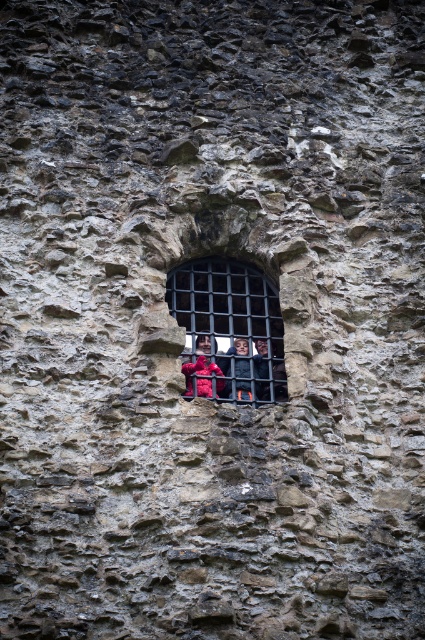
You are standing in front of an ancient stone wall with an arched window. A point on the wall is marked at coordinates point (251,333). If you want to touch this point with a 200 feet long stick, will you be able to reach it?

The point (251,333) is 243.87 feet away from the viewer. Since the stick is only 200 feet long, you cannot reach the point with the stick.

You are an architect examining the stone wall with a small arched window. You notice a specific point marked at coordinates (229,330). What object is located at this point?

The black metal bars at center is located at point (229,330).